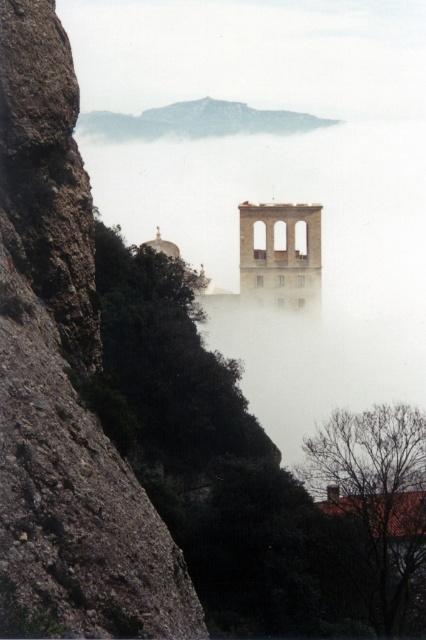
Question: Among these objects, which one is nearest to the camera?

Choices:
 (A) smooth stone bell tower at center
 (B) rough stone cliff at left
 (C) rocky gray mountain at upper center

Answer: (B)

Question: Which point is farther to the camera?

Choices:
 (A) (317, 284)
 (B) (270, 125)
 (C) (14, 588)

Answer: (B)

Question: Which is farther from the rough stone cliff at left?

Choices:
 (A) smooth stone bell tower at center
 (B) rocky gray mountain at upper center

Answer: (B)

Question: Is the position of rough stone cliff at left less distant than that of rocky gray mountain at upper center?

Choices:
 (A) no
 (B) yes

Answer: (B)

Question: Can you confirm if rough stone cliff at left is thinner than smooth stone bell tower at center?

Choices:
 (A) no
 (B) yes

Answer: (A)

Question: From the image, what is the correct spatial relationship of rough stone cliff at left in relation to smooth stone bell tower at center?

Choices:
 (A) below
 (B) above

Answer: (A)